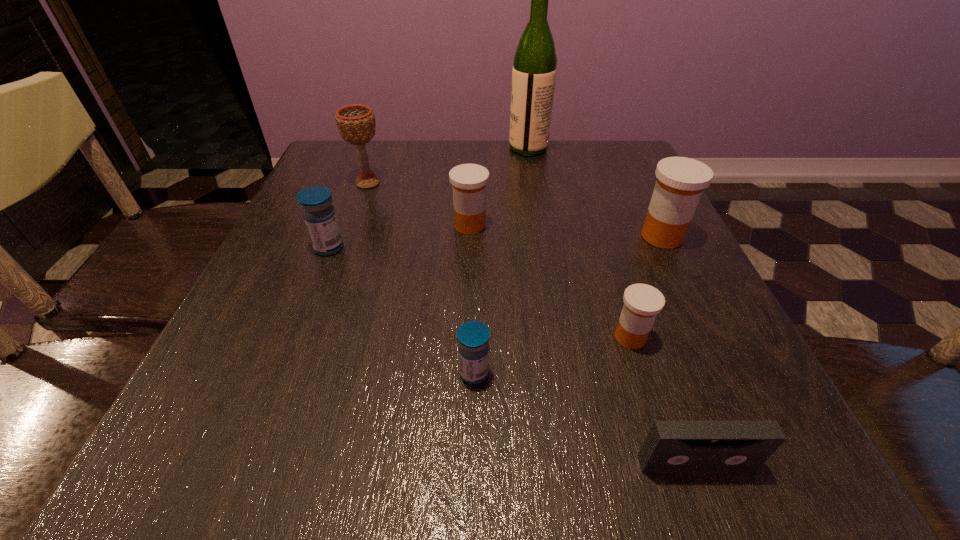
The height and width of the screenshot is (540, 960). I want to click on free space between the smallest orange medicine and the fifth object from left to right, so click(580, 243).

Where is `free space between the beige chalice and the farthest object`? Image resolution: width=960 pixels, height=540 pixels. free space between the beige chalice and the farthest object is located at coordinates (448, 166).

This screenshot has width=960, height=540. What are the coordinates of `free point between the left blue medicine and the chalice` in the screenshot? It's located at (348, 215).

Locate an element on the screen. free space between the leftmost orange medicine and the liquor is located at coordinates [499, 187].

This screenshot has height=540, width=960. Find the location of `free point between the videotape and the fourth medicine from left to right`. free point between the videotape and the fourth medicine from left to right is located at coordinates coord(663,401).

Identify the location of vacant region between the beige chalice and the seventh farthest object. (420, 278).

This screenshot has height=540, width=960. I want to click on free space between the videotape and the seventh nearest object, so click(532, 323).

You are a GUI agent. You are given a task and a screenshot of the screen. Output one action in this format:
    pyautogui.click(x=<x>, y=<y>)
    Task: Click on the vacant space that is in between the nearer blue medicine and the beige chalice
    Image resolution: width=960 pixels, height=540 pixels.
    Given the screenshot: What is the action you would take?
    pyautogui.click(x=420, y=278)

Where is `vacant area that lies between the second farthest object and the smaller blue medicine`? The width and height of the screenshot is (960, 540). vacant area that lies between the second farthest object and the smaller blue medicine is located at coordinates (420, 278).

Locate an element on the screen. Image resolution: width=960 pixels, height=540 pixels. free space between the tallest object and the chalice is located at coordinates (448, 166).